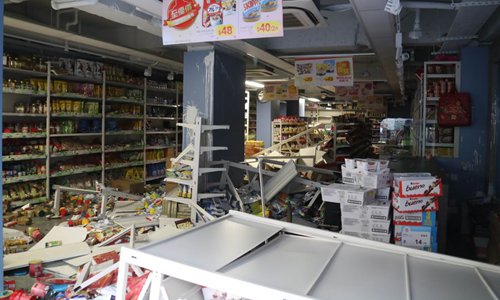
The width and height of the screenshot is (500, 300). Identify the location of ceiling light. (253, 84).